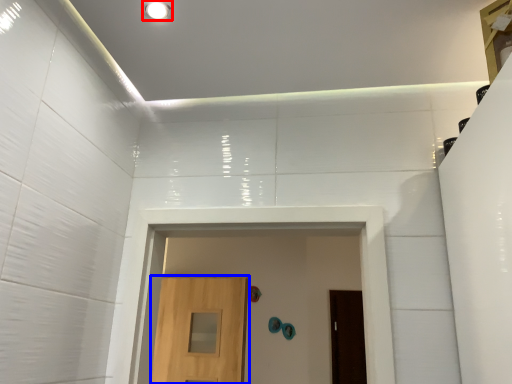
Question: Among these objects, which one is farthest to the camera, lighting (highlighted by a red box) or door (highlighted by a blue box)?

Choices:
 (A) lighting
 (B) door

Answer: (B)